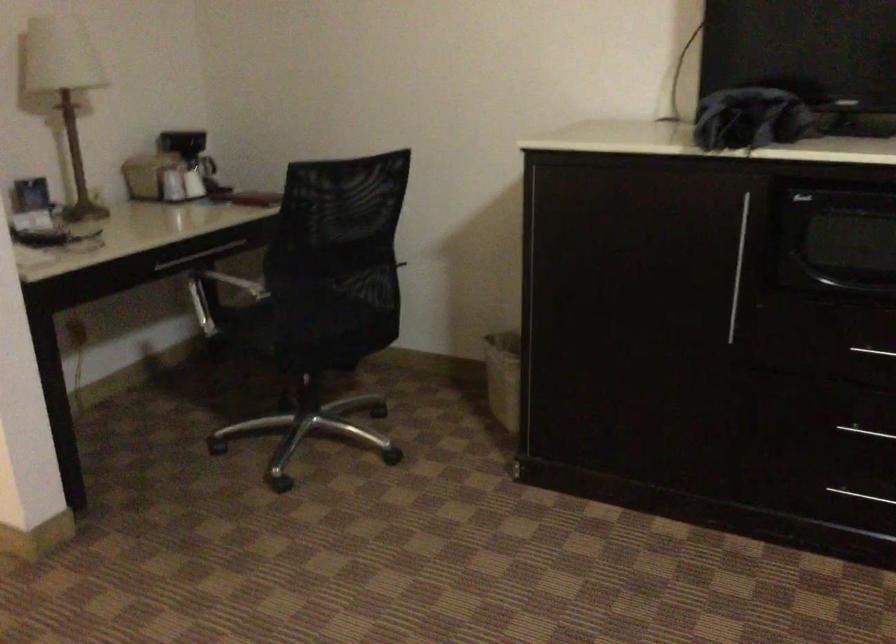
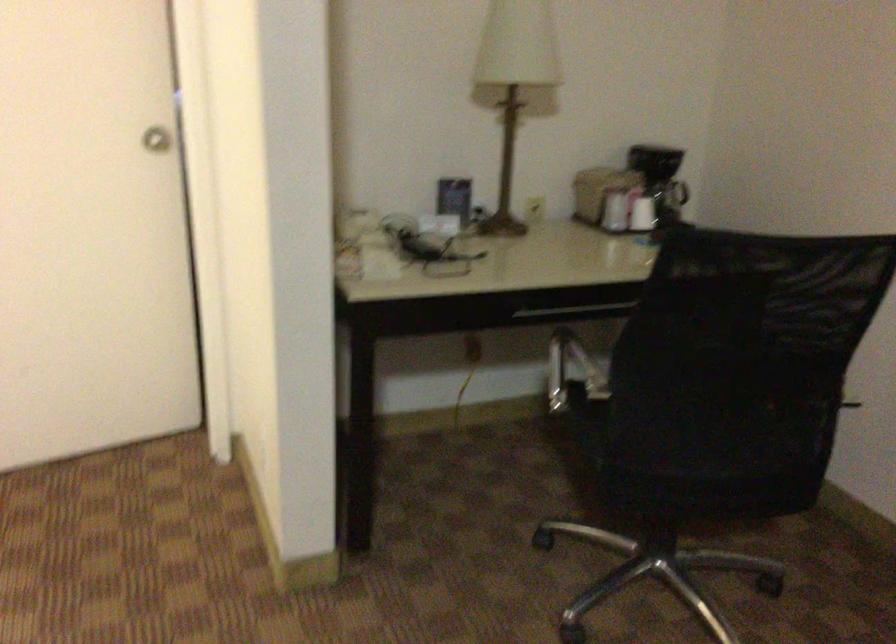
The point at (151, 167) is marked in the first image. Where is the corresponding point in the second image?

(599, 190)